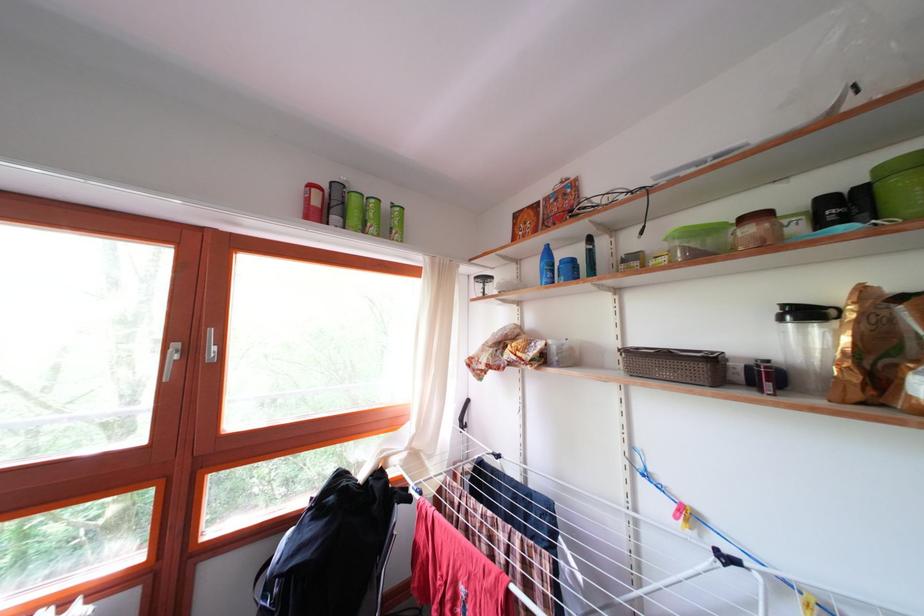
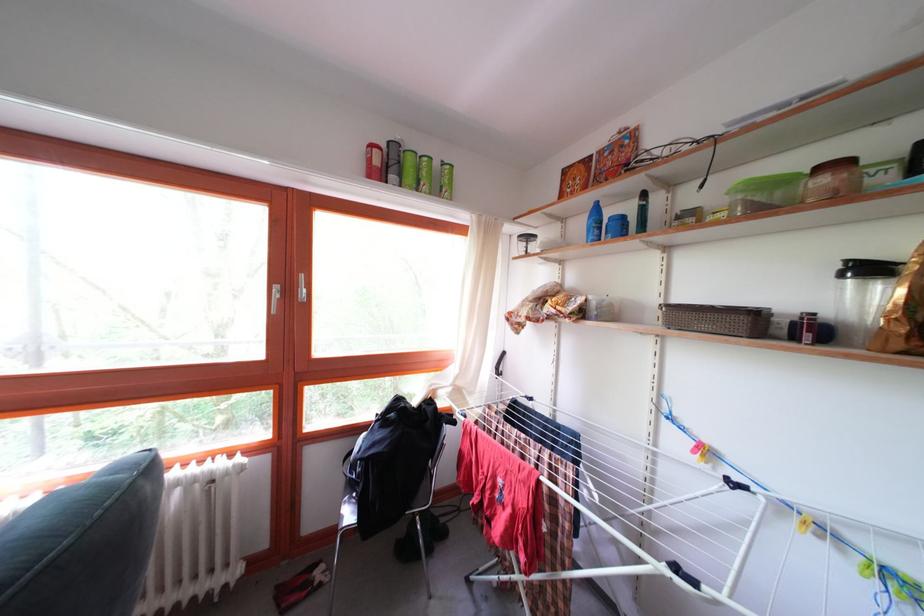
Question: Based on the continuous images, in which direction is the camera rotating? Reply with the corresponding letter.

Choices:
 (A) Left
 (B) Right
 (C) Up
 (D) Down

Answer: (D)